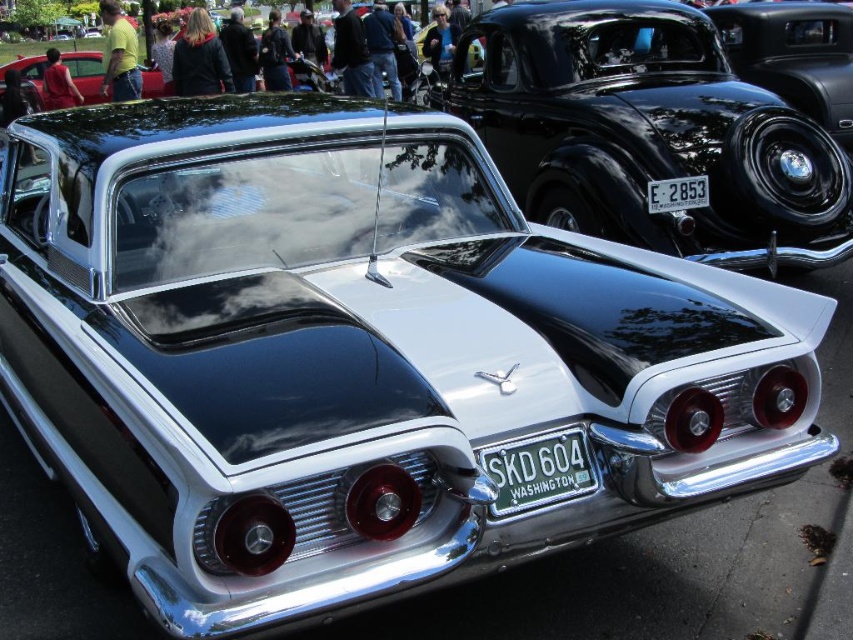
Does point (691, 49) lie in front of point (701, 188)?

No, it is not.

Measure the distance between shiny black car at upper right and camera.

shiny black car at upper right is 15.29 feet from camera.

The height and width of the screenshot is (640, 853). What do you see at coordinates (647, 132) in the screenshot? I see `shiny black car at upper right` at bounding box center [647, 132].

Identify the location of shiny black car at upper right. The height and width of the screenshot is (640, 853). pos(647,132).

Does point (573, 464) lie behind point (699, 196)?

No, (573, 464) is closer to viewer.

Identify the location of green metallic license plate at center. (538, 470).

Identify the location of green metallic license plate at center. (538, 470).

Is point (659, 52) positioned after point (531, 496)?

Yes, point (659, 52) is farther from viewer.

Is shiny black car at upper right behind green metallic license plate at center?

Yes, shiny black car at upper right is behind green metallic license plate at center.

You are a GUI agent. You are given a task and a screenshot of the screen. Output one action in this format:
    pyautogui.click(x=<x>, y=<y>)
    Task: Click on the shiny black car at upper right
    The width and height of the screenshot is (853, 640).
    Given the screenshot: What is the action you would take?
    pyautogui.click(x=647, y=132)

At what (x,y) coordinates should I click in order to perform the action: click on shiny black car at upper right. Please return your answer as a coordinate pair (x, y). Looking at the image, I should click on (647, 132).